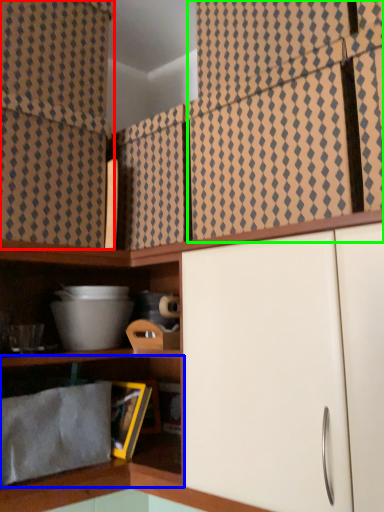
Question: Considering the real-world distances, which object is closest to curtain (highlighted by a red box)? shelf (highlighted by a blue box) or curtain (highlighted by a green box).

Choices:
 (A) shelf
 (B) curtain

Answer: (B)